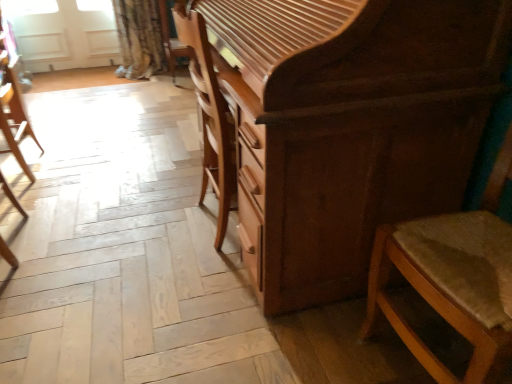
This screenshot has height=384, width=512. Describe the element at coordinates (63, 33) in the screenshot. I see `white matte screen door at upper left` at that location.

What do you see at coordinates (449, 279) in the screenshot? This screenshot has height=384, width=512. I see `wooden textured chair at right, which is counted as the 1th chair, starting from the right` at bounding box center [449, 279].

At what (x,y) coordinates should I click in order to perform the action: click on wooden chair at left, which appears as the second chair when viewed from the front. Please return your answer as a coordinate pair (x, y). The height and width of the screenshot is (384, 512). Looking at the image, I should click on (x=13, y=108).

Between shiny brown chest of drawers at center and wooden chair at left, the 2th chair in the right-to-left sequence, which one is positioned in front?

shiny brown chest of drawers at center is closer to the camera.

Are shiny brown chest of drawers at center and wooden chair at left, placed as the first chair when sorted from back to front, far apart?

Indeed, shiny brown chest of drawers at center is not near wooden chair at left, placed as the first chair when sorted from back to front.

Does point (272, 240) come farther from viewer compared to point (4, 118)?

No.

Measure the distance from shiny brown chest of drawers at center to wooden chair at left, the 2th chair in the right-to-left sequence.

shiny brown chest of drawers at center and wooden chair at left, the 2th chair in the right-to-left sequence, are 5.59 feet apart.

Which point is more distant from viewer, (57, 20) or (21, 98)?

Point (57, 20)

Considering the positions of objects white matte screen door at upper left and wooden chair at left, which is counted as the 1th chair, starting from the left, in the image provided, who is more to the left, white matte screen door at upper left or wooden chair at left, which is counted as the 1th chair, starting from the left,?

Positioned to the left is white matte screen door at upper left.

Does white matte screen door at upper left touch wooden chair at left, the 2th chair in the right-to-left sequence?

There is a gap between white matte screen door at upper left and wooden chair at left, the 2th chair in the right-to-left sequence.

Is point (374, 300) positioned after point (266, 277)?

No, (374, 300) is closer to viewer.

Would you say wooden textured chair at right, arranged as the 1th chair when viewed from the front, contains shiny brown chest of drawers at center?

That's incorrect, shiny brown chest of drawers at center is not inside wooden textured chair at right, arranged as the 1th chair when viewed from the front.

The image size is (512, 384). In order to click on chair lying below the shiny brown chest of drawers at center (from the image's perspective) in this screenshot , I will do `click(449, 279)`.

Based on the photo, does wooden textured chair at right, which is counted as the 1th chair, starting from the right, turn towards shiny brown chest of drawers at center?

No.

Is shiny brown chest of drawers at center oriented towards white matte screen door at upper left?

No, shiny brown chest of drawers at center is not aimed at white matte screen door at upper left.

Would you consider shiny brown chest of drawers at center to be distant from white matte screen door at upper left?

Yes.

In the scene shown: Is shiny brown chest of drawers at center further to the viewer compared to white matte screen door at upper left?

No, shiny brown chest of drawers at center is in front of white matte screen door at upper left.

I want to click on the 2nd chair below when counting from the white matte screen door at upper left (from the image's perspective), so click(x=449, y=279).

Based on the photo, is the depth of white matte screen door at upper left greater than that of wooden textured chair at right, which is counted as the 1th chair, starting from the right?

Yes, it is.

From a real-world perspective, is white matte screen door at upper left physically below wooden textured chair at right, which is counted as the 1th chair, starting from the right?

Yes, from a real-world perspective, white matte screen door at upper left is below wooden textured chair at right, which is counted as the 1th chair, starting from the right.

Which object is wider, white matte screen door at upper left or wooden textured chair at right, arranged as the 1th chair when viewed from the front?

wooden textured chair at right, arranged as the 1th chair when viewed from the front.

Is wooden chair at left, which appears as the second chair when viewed from the front, at the back of wooden textured chair at right, marked as the 2th chair in a back-to-front arrangement?

wooden textured chair at right, marked as the 2th chair in a back-to-front arrangement, does not have its back to wooden chair at left, which appears as the second chair when viewed from the front.

From a real-world perspective, is wooden textured chair at right, which is counted as the 1th chair, starting from the right, located beneath wooden chair at left, which is counted as the 1th chair, starting from the left?

Actually, wooden textured chair at right, which is counted as the 1th chair, starting from the right, is physically above wooden chair at left, which is counted as the 1th chair, starting from the left, in the real world.

From the image's perspective, is wooden textured chair at right, the 2th chair in the left-to-right sequence, on top of wooden chair at left, placed as the first chair when sorted from back to front?

Incorrect, from the image's perspective, wooden textured chair at right, the 2th chair in the left-to-right sequence, is lower than wooden chair at left, placed as the first chair when sorted from back to front.

Which of these two, wooden textured chair at right, marked as the 2th chair in a back-to-front arrangement, or wooden chair at left, placed as the first chair when sorted from back to front, is smaller?

wooden chair at left, placed as the first chair when sorted from back to front.

Is white matte screen door at upper left surrounded by wooden textured chair at right, arranged as the 1th chair when viewed from the front?

That's incorrect, white matte screen door at upper left is not inside wooden textured chair at right, arranged as the 1th chair when viewed from the front.

Are wooden textured chair at right, arranged as the 1th chair when viewed from the front, and white matte screen door at upper left located far from each other?

wooden textured chair at right, arranged as the 1th chair when viewed from the front, is positioned a significant distance from white matte screen door at upper left.

Considering the sizes of wooden textured chair at right, the 2th chair in the left-to-right sequence, and white matte screen door at upper left in the image, is wooden textured chair at right, the 2th chair in the left-to-right sequence, taller or shorter than white matte screen door at upper left?

wooden textured chair at right, the 2th chair in the left-to-right sequence, is taller than white matte screen door at upper left.

From a real-world perspective, count 2nd chairs downward from the shiny brown chest of drawers at center and point to it. Please provide its 2D coordinates.

[(13, 108)]

Which chair is the 1st one when counting from the right side of the white matte screen door at upper left? Please provide its 2D coordinates.

[(13, 108)]

Based on the photo, looking at the image, which one is located closer to white matte screen door at upper left, shiny brown chest of drawers at center or wooden textured chair at right, arranged as the 1th chair when viewed from the front?

The object closer to white matte screen door at upper left is shiny brown chest of drawers at center.

From the image, which object appears to be nearer to shiny brown chest of drawers at center, white matte screen door at upper left or wooden chair at left, which is counted as the 1th chair, starting from the left?

The object closer to shiny brown chest of drawers at center is wooden chair at left, which is counted as the 1th chair, starting from the left.

When comparing their distances from wooden chair at left, the 2th chair in the right-to-left sequence, does shiny brown chest of drawers at center or wooden textured chair at right, which is counted as the 1th chair, starting from the right, seem closer?

shiny brown chest of drawers at center lies closer to wooden chair at left, the 2th chair in the right-to-left sequence, than the other object.

Considering their positions, is wooden chair at left, placed as the first chair when sorted from back to front, positioned closer to shiny brown chest of drawers at center than white matte screen door at upper left?

wooden chair at left, placed as the first chair when sorted from back to front, is closer to shiny brown chest of drawers at center.

Considering their positions, is white matte screen door at upper left positioned further to shiny brown chest of drawers at center than wooden textured chair at right, the 2th chair in the left-to-right sequence?

white matte screen door at upper left is further to shiny brown chest of drawers at center.

From the image, which object appears to be nearer to wooden chair at left, which appears as the second chair when viewed from the front, wooden textured chair at right, the 2th chair in the left-to-right sequence, or shiny brown chest of drawers at center?

shiny brown chest of drawers at center.

When comparing their distances from shiny brown chest of drawers at center, does wooden chair at left, placed as the first chair when sorted from back to front, or wooden textured chair at right, the 2th chair in the left-to-right sequence, seem further?

wooden chair at left, placed as the first chair when sorted from back to front.

Looking at the image, which one is located further to wooden chair at left, the 2th chair in the right-to-left sequence, white matte screen door at upper left or wooden textured chair at right, marked as the 2th chair in a back-to-front arrangement?

wooden textured chair at right, marked as the 2th chair in a back-to-front arrangement, is positioned further to the anchor wooden chair at left, the 2th chair in the right-to-left sequence.

Where is `chest of drawers between wooden textured chair at right, arranged as the 1th chair when viewed from the front, and white matte screen door at upper left from front to back`? The image size is (512, 384). chest of drawers between wooden textured chair at right, arranged as the 1th chair when viewed from the front, and white matte screen door at upper left from front to back is located at coordinates (349, 126).

Where is `chair between shiny brown chest of drawers at center and white matte screen door at upper left from front to back`? chair between shiny brown chest of drawers at center and white matte screen door at upper left from front to back is located at coordinates (13, 108).

This screenshot has width=512, height=384. What are the coordinates of `chair between wooden textured chair at right, arranged as the 1th chair when viewed from the front, and white matte screen door at upper left from front to back` in the screenshot? It's located at (13, 108).

Where is `chest of drawers between wooden chair at left, which appears as the second chair when viewed from the front, and wooden textured chair at right, the 2th chair in the left-to-right sequence, in the horizontal direction`? chest of drawers between wooden chair at left, which appears as the second chair when viewed from the front, and wooden textured chair at right, the 2th chair in the left-to-right sequence, in the horizontal direction is located at coordinates (349, 126).